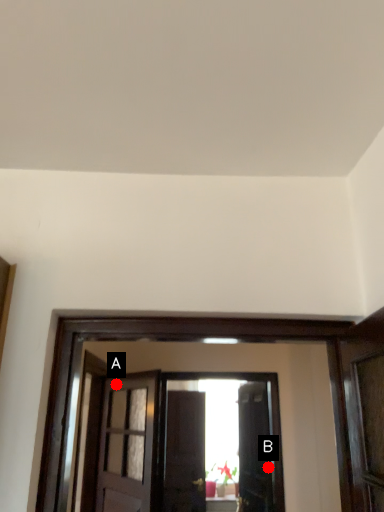
Question: Two points are circled on the image, labeled by A and B beside each circle. Which point is farther to the camera?

Choices:
 (A) A is further
 (B) B is further

Answer: (B)